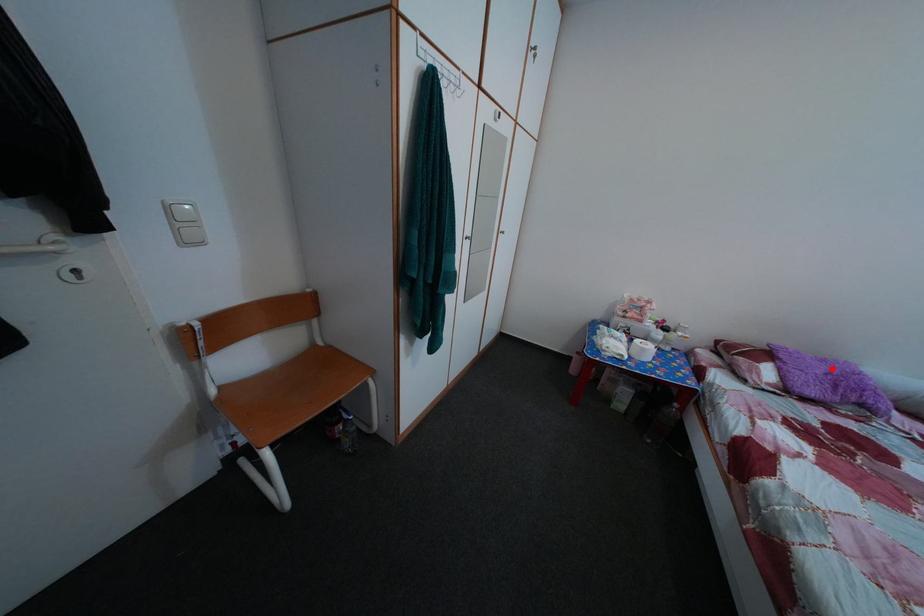
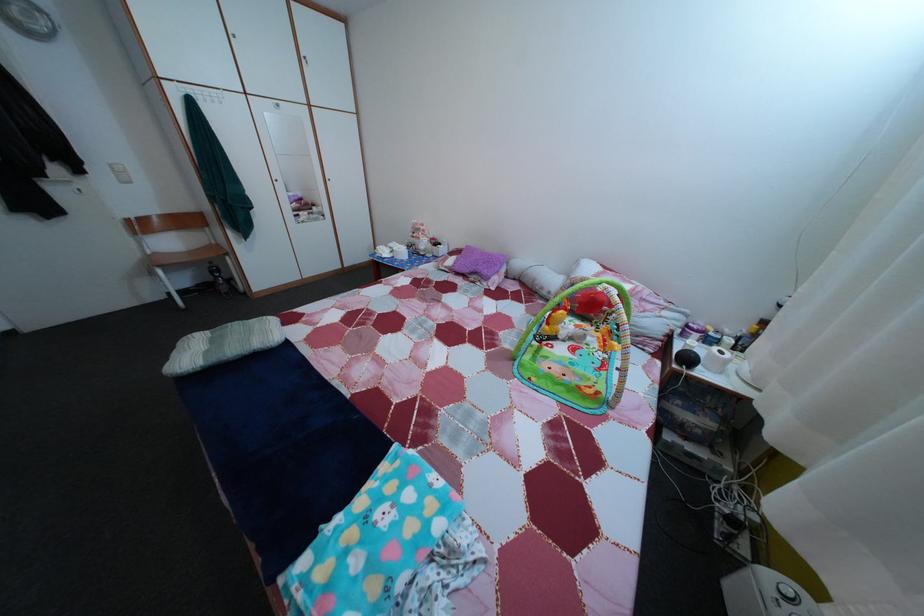
In the second image, find the point that corresponds to the highlighted location in the first image.

(492, 261)